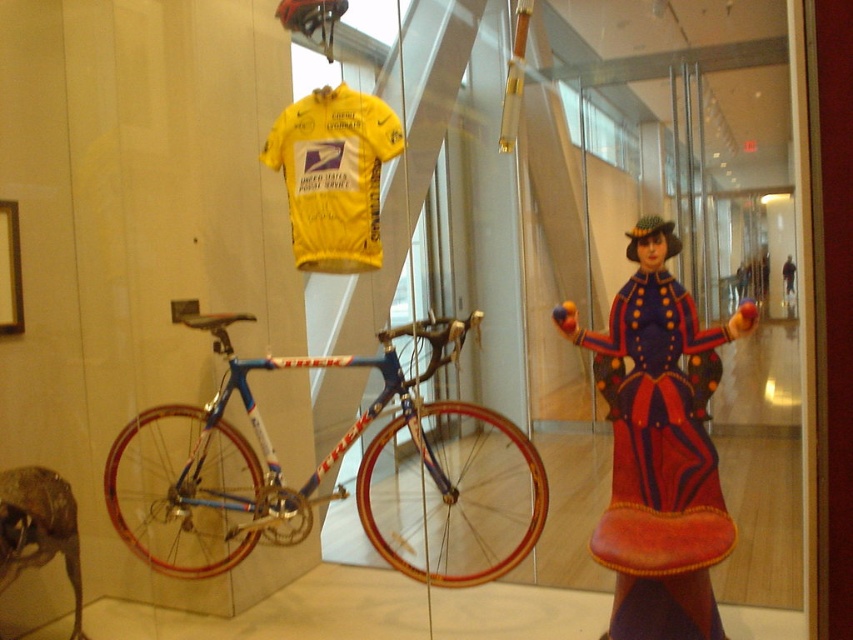
Does point (439, 106) come behind point (416, 378)?

Yes, point (439, 106) is farther from viewer.

Is point (556, 216) closer to viewer compared to point (252, 369)?

No, it is not.

Where is `metallic bicycle at center`? This screenshot has width=853, height=640. metallic bicycle at center is located at coordinates (625, 237).

Is blue metallic bicycle at center shorter than velvet-like red dress at right?

Indeed, blue metallic bicycle at center has a lesser height compared to velvet-like red dress at right.

Between blue metallic bicycle at center and velvet-like red dress at right, which one has less height?

Standing shorter between the two is blue metallic bicycle at center.

Who is more distant from viewer, (142, 531) or (701, 515)?

The point (142, 531) is behind.

Image resolution: width=853 pixels, height=640 pixels. I want to click on blue metallic bicycle at center, so click(316, 468).

The height and width of the screenshot is (640, 853). What do you see at coordinates (625, 237) in the screenshot?
I see `metallic bicycle at center` at bounding box center [625, 237].

Is point (546, 342) behind point (683, 582)?

Yes.

This screenshot has height=640, width=853. Identify the location of metallic bicycle at center. (625, 237).